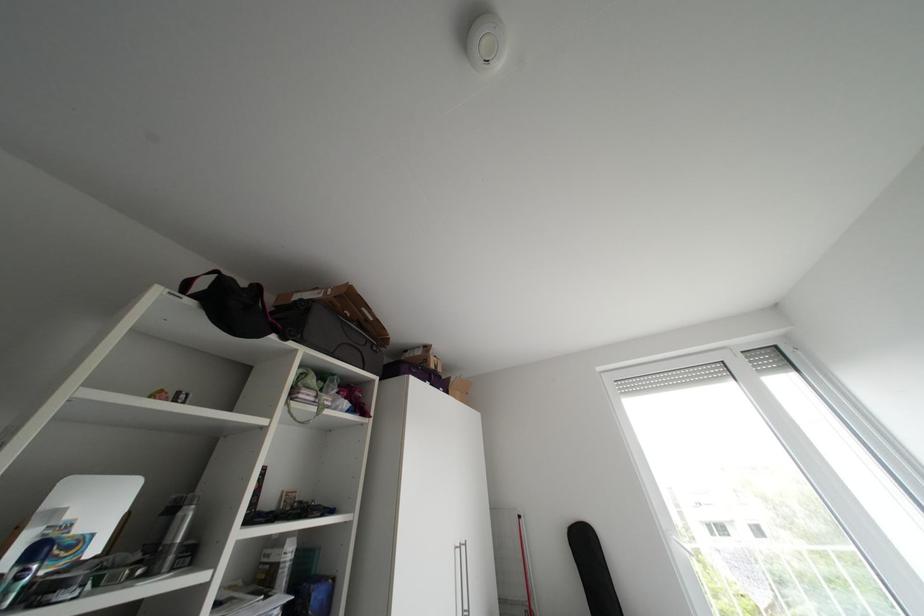
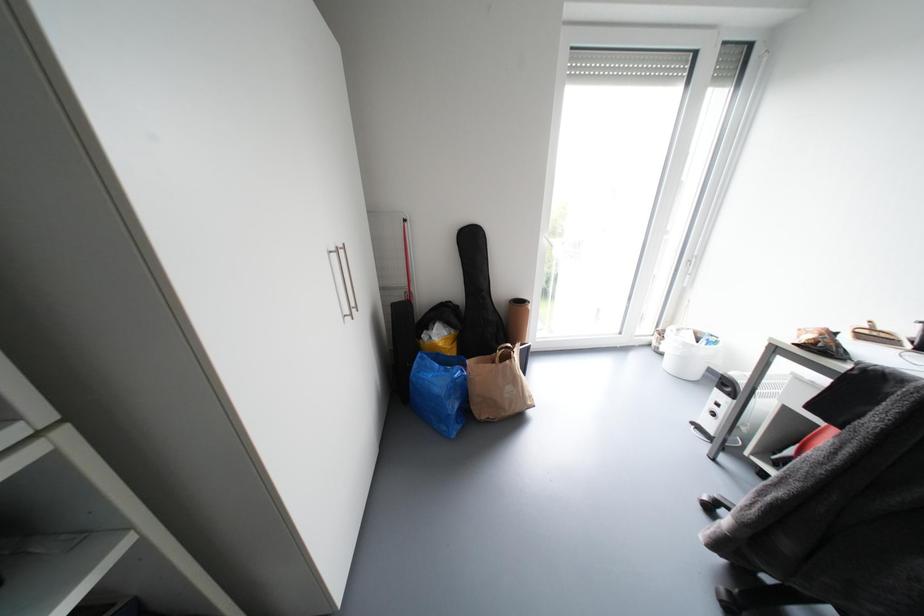
The first image is from the beginning of the video and the second image is from the end. How did the camera likely rotate when shooting the video?

The camera rotated toward right-down.